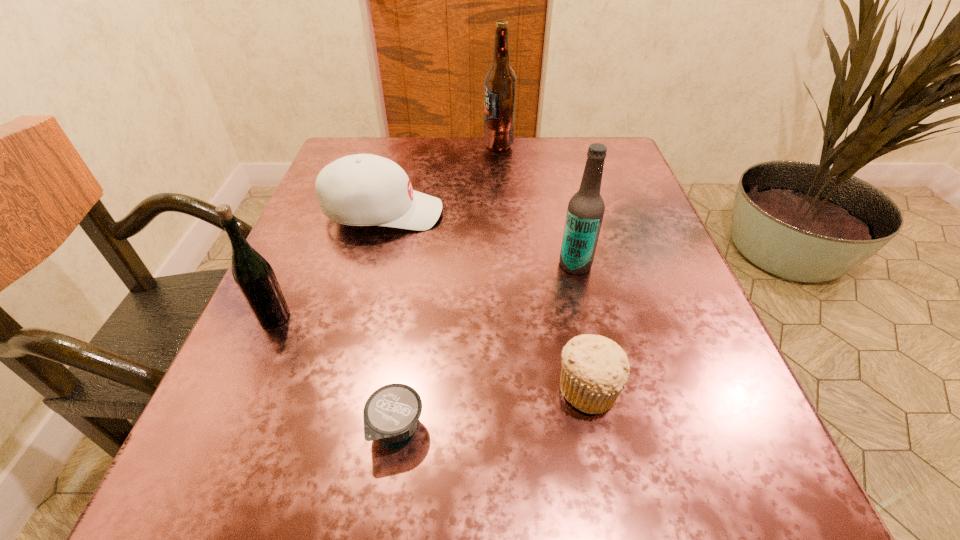
This screenshot has width=960, height=540. I want to click on free location located on the label of the farthest beer bottle, so click(375, 145).

Find the location of `vacant space located on the label of the farthest beer bottle`. vacant space located on the label of the farthest beer bottle is located at coordinates (440, 145).

The height and width of the screenshot is (540, 960). What are the coordinates of `blank space located 0.070m on the label of the farthest beer bottle` in the screenshot? It's located at (456, 145).

This screenshot has height=540, width=960. Find the location of `free space located 0.400m on the label of the third farthest object`. free space located 0.400m on the label of the third farthest object is located at coordinates (333, 265).

Find the location of a particular element. vacant space situated 0.240m on the label of the third farthest object is located at coordinates (423, 265).

Locate an element on the screen. The height and width of the screenshot is (540, 960). free location located 0.300m on the label of the third farthest object is located at coordinates pos(390,265).

Where is `free space located 0.310m on the right of the leftmost beer bottle`? free space located 0.310m on the right of the leftmost beer bottle is located at coordinates (487, 317).

Find the location of a particular element. This screenshot has width=960, height=540. vacant region located 0.360m on the front-facing side of the fourth tallest object is located at coordinates (621, 213).

This screenshot has width=960, height=540. Find the location of `vacant space located on the left of the second shortest object`. vacant space located on the left of the second shortest object is located at coordinates (431, 388).

At what (x,y) coordinates should I click in order to perform the action: click on vacant space situated on the left of the yogurt. Please return your answer as a coordinate pair (x, y). Image resolution: width=960 pixels, height=540 pixels. Looking at the image, I should click on (299, 427).